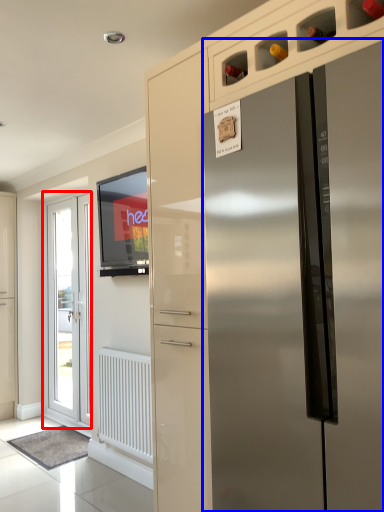
Question: Which point is further to the camera, door (highlighted by a red box) or refrigerator (highlighted by a blue box)?

Choices:
 (A) door
 (B) refrigerator

Answer: (A)